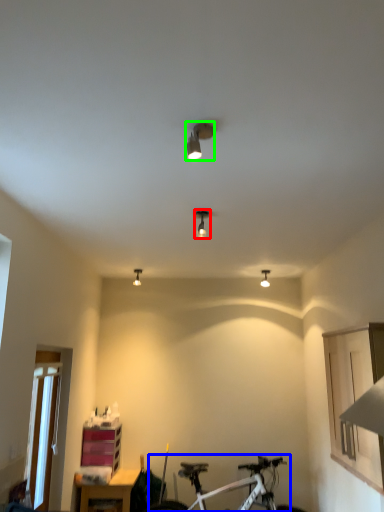
Question: Considering the real-world distances, which object is farthest from light fixture (highlighted by a red box)? bicycle (highlighted by a blue box) or light fixture (highlighted by a green box)?

Choices:
 (A) bicycle
 (B) light fixture

Answer: (A)